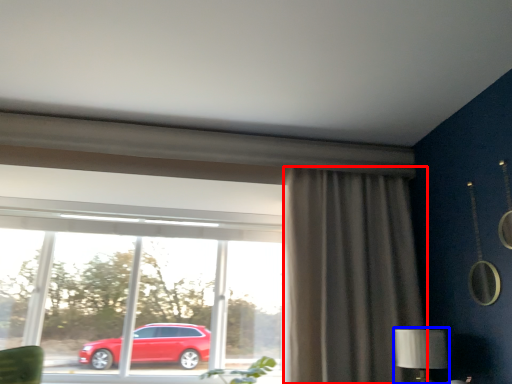
Question: Among these objects, which one is farthest to the camera, curtain (highlighted by a red box) or table lamp (highlighted by a blue box)?

Choices:
 (A) curtain
 (B) table lamp

Answer: (A)